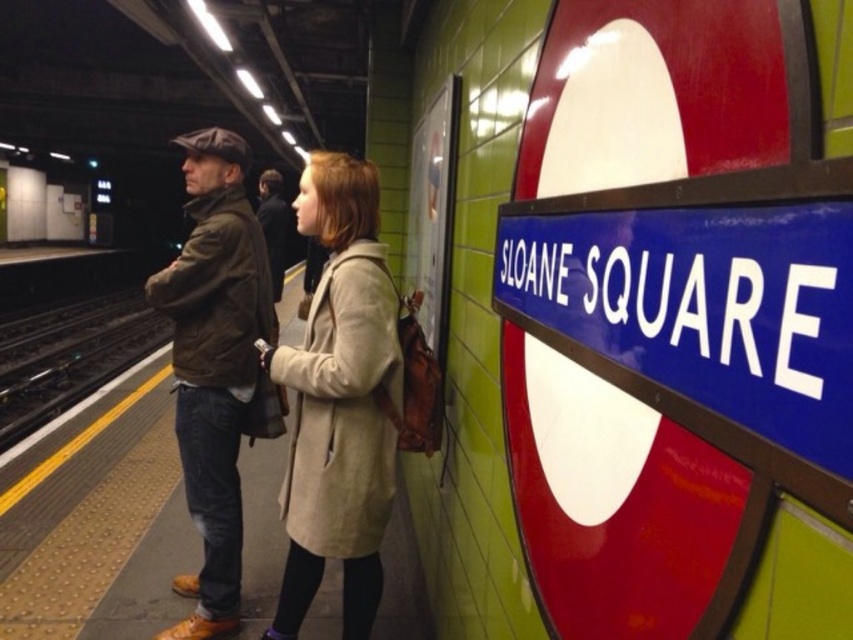
Can you confirm if brown leather jacket at center is smaller than dark brown leather jacket at center?

No, brown leather jacket at center is not smaller than dark brown leather jacket at center.

Locate an element on the screen. The height and width of the screenshot is (640, 853). brown leather jacket at center is located at coordinates (216, 365).

I want to click on brown leather jacket at center, so click(216, 365).

Between beige wool coat at center and dark brown leather jacket at center, which one is positioned higher?

dark brown leather jacket at center is higher up.

You are a GUI agent. You are given a task and a screenshot of the screen. Output one action in this format:
    pyautogui.click(x=<x>, y=<y>)
    Task: Click on the beige wool coat at center
    
    Given the screenshot: What is the action you would take?
    pyautogui.click(x=339, y=401)

Find the location of `beige wool coat at center`. beige wool coat at center is located at coordinates (339, 401).

Who is shorter, beige wool coat at center or brown leather jacket at center?

beige wool coat at center

Based on the photo, which is more to the right, beige wool coat at center or brown leather jacket at center?

beige wool coat at center

Identify the location of beige wool coat at center. [339, 401].